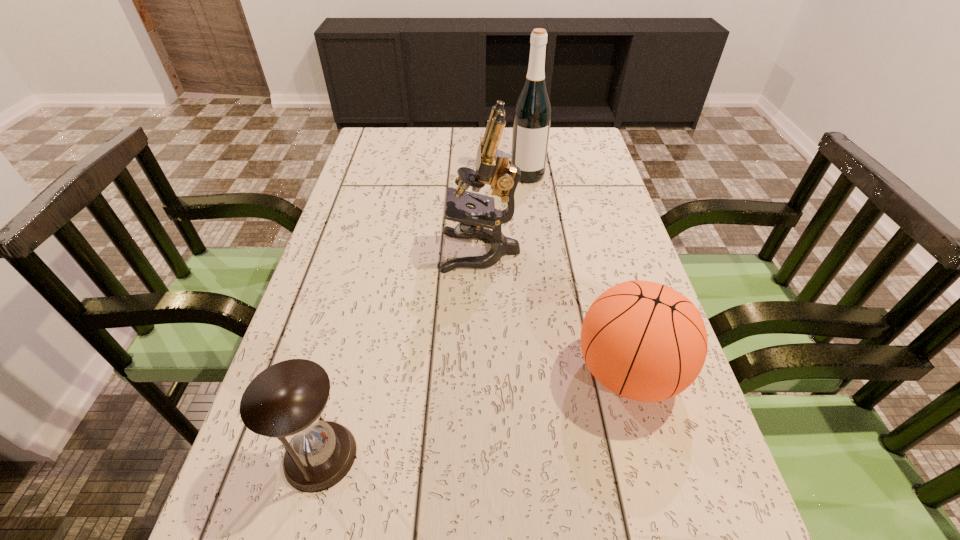
Where is `wine bottle`? This screenshot has height=540, width=960. wine bottle is located at coordinates (532, 115).

Locate an element on the screen. The width and height of the screenshot is (960, 540). microscope is located at coordinates (493, 167).

You are a GUI agent. You are given a task and a screenshot of the screen. Output one action in this format:
    pyautogui.click(x=<x>, y=<y>)
    Task: Click on the basketball
    
    Given the screenshot: What is the action you would take?
    pyautogui.click(x=644, y=341)

Find the location of a particular element. This screenshot has height=540, width=960. the leftmost object is located at coordinates (286, 399).

Where is `vacant space located 0.240m on the label of the farthest object`? vacant space located 0.240m on the label of the farthest object is located at coordinates (536, 234).

Locate an element on the screen. Image resolution: width=960 pixels, height=540 pixels. vacant position located at the eyepieces of the second farthest object is located at coordinates (332, 251).

What are the coordinates of `vacant point located 0.280m at the eyepieces of the second farthest object` in the screenshot? It's located at (332, 251).

Locate an element on the screen. vacant space located at the eyepieces of the second farthest object is located at coordinates (360, 251).

This screenshot has height=540, width=960. In order to click on free space located 0.160m on the left of the basketball in this screenshot , I will do `click(492, 372)`.

You are a GUI agent. You are given a task and a screenshot of the screen. Output one action in this format:
    pyautogui.click(x=<x>, y=<y>)
    Task: Click on the vacant area located 0.290m on the right of the hourglass
    This screenshot has height=540, width=960.
    Given the screenshot: What is the action you would take?
    pyautogui.click(x=525, y=456)